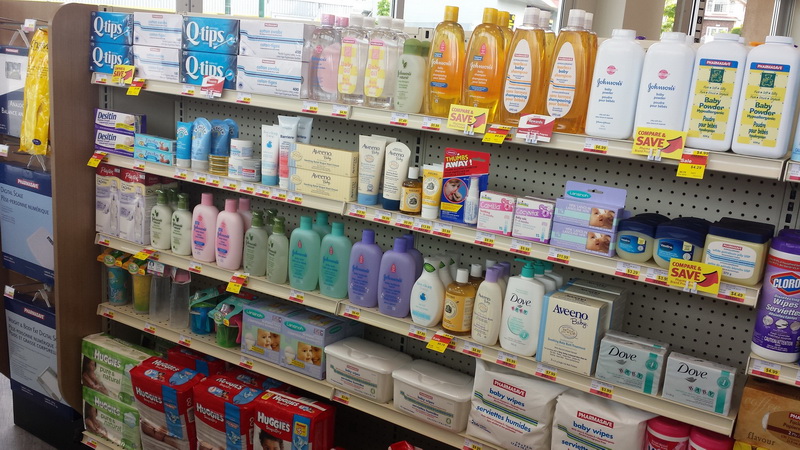
Where is `window`? window is located at coordinates (724, 15), (670, 14), (354, 2).